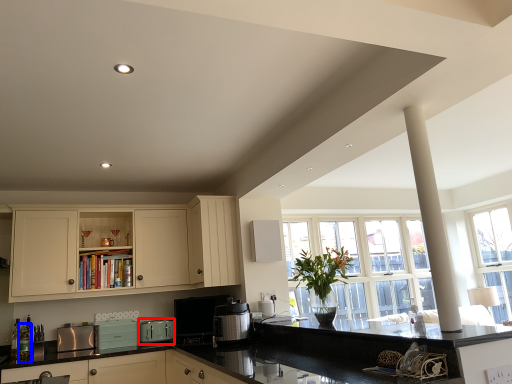
Question: Which object appears closest to the camera in this image, appliance (highlighted by a red box) or bottle (highlighted by a blue box)?

Choices:
 (A) appliance
 (B) bottle

Answer: (B)